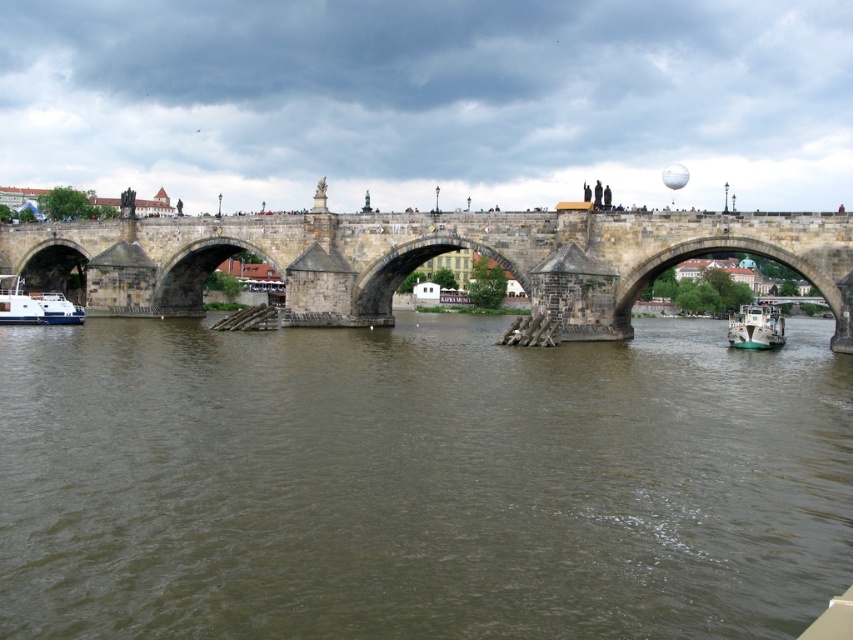
Question: Considering the real-world distances, which object is closest to the white glossy boat at lower left?

Choices:
 (A) brown murky water at center
 (B) stone bridge at center
 (C) white glossy boat at lower right

Answer: (B)

Question: Is brown murky water at center bigger than white glossy boat at lower left?

Choices:
 (A) no
 (B) yes

Answer: (B)

Question: Among these objects, which one is farthest from the camera?

Choices:
 (A) white glossy boat at lower right
 (B) stone bridge at center
 (C) brown murky water at center

Answer: (A)

Question: Which point is closer to the camera taking this photo?

Choices:
 (A) (740, 307)
 (B) (201, 276)
 (C) (57, 301)
 (D) (155, 458)

Answer: (D)

Question: Is white glossy boat at lower left above white glossy boat at lower right?

Choices:
 (A) yes
 (B) no

Answer: (A)

Question: Considering the relative positions of stone bridge at center and white glossy boat at lower left in the image provided, where is stone bridge at center located with respect to white glossy boat at lower left?

Choices:
 (A) above
 (B) below

Answer: (A)